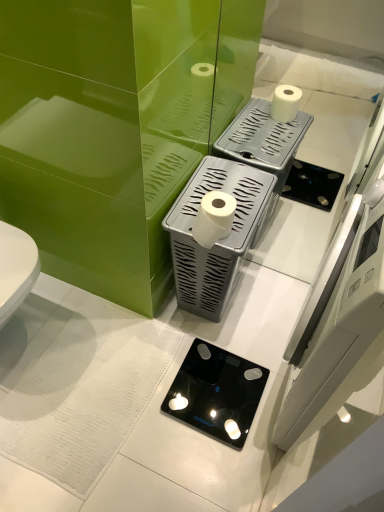
Where is `empty space that is ontop of black glass scale at center, the second appliance when ordered from top to bottom (from a real-world perspective)`? The height and width of the screenshot is (512, 384). empty space that is ontop of black glass scale at center, the second appliance when ordered from top to bottom (from a real-world perspective) is located at coordinates (225, 384).